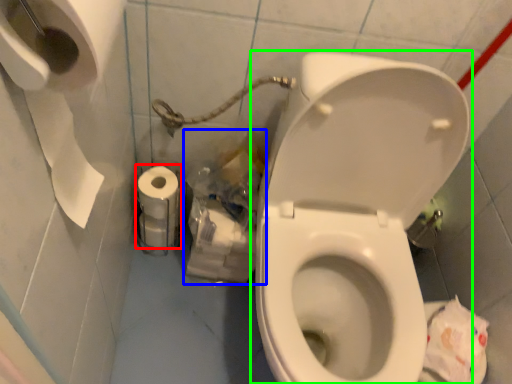
Question: Which object is the closest to the toilet paper (highlighted by a red box)? Choose among these: garbage (highlighted by a blue box) or toilet (highlighted by a green box).

Choices:
 (A) garbage
 (B) toilet

Answer: (A)